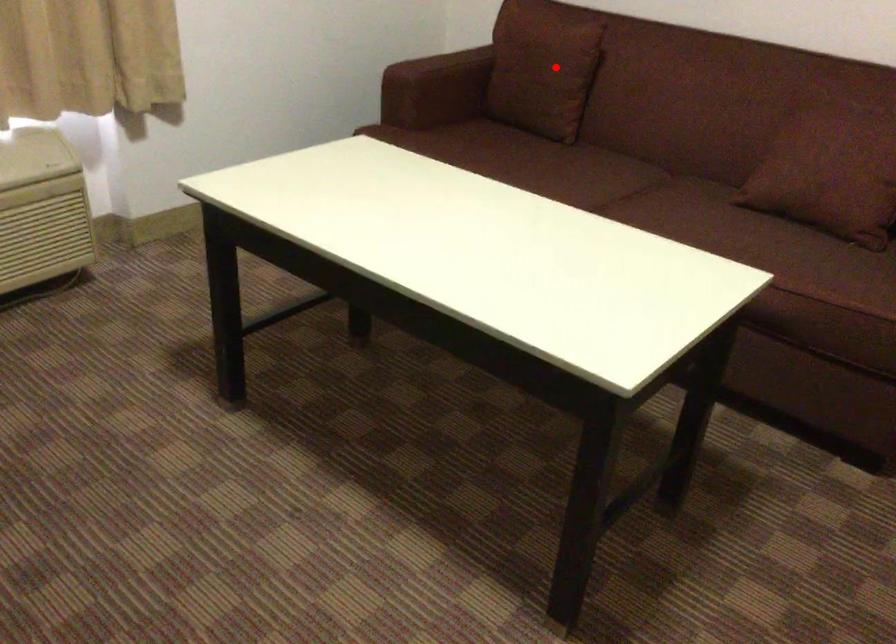
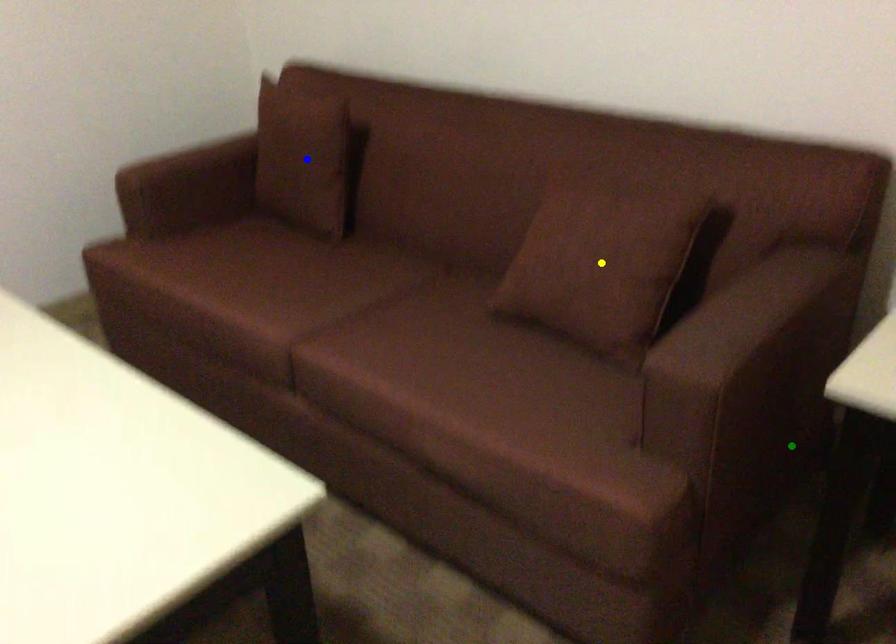
Question: I am providing you with two images of the same scene from different viewpoints. A red point is marked on the first image. You are given multiple points on the second image. In image 2, which mark is for the same physical point as the one in image 1?

Choices:
 (A) yellow point
 (B) green point
 (C) blue point

Answer: (C)